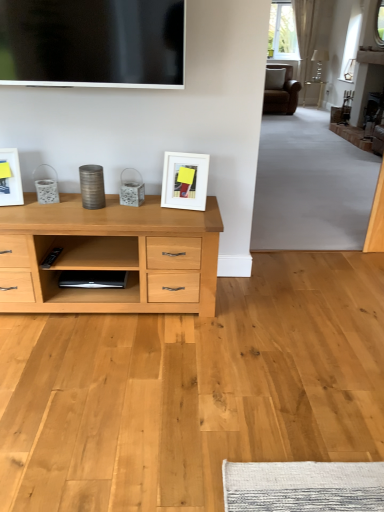
How much space does white glossy picture frame at left, positioned as the second picture frame in right-to-left order, occupy vertically?

It is 10.57 inches.

Describe the element at coordinates (10, 178) in the screenshot. The image size is (384, 512). I see `white glossy picture frame at left, positioned as the second picture frame in right-to-left order` at that location.

At what (x,y) coordinates should I click in order to perform the action: click on white matte picture frame at center, acting as the 2th picture frame starting from the left. Please return your answer as a coordinate pair (x, y). Image resolution: width=384 pixels, height=512 pixels. Looking at the image, I should click on (185, 181).

Does point (184, 161) come closer to viewer compared to point (2, 195)?

No, (184, 161) is behind (2, 195).

From the picture: Is white matte picture frame at center, acting as the 2th picture frame starting from the left, positioned behind white glossy picture frame at left, positioned as the second picture frame in right-to-left order?

Yes, white matte picture frame at center, acting as the 2th picture frame starting from the left, is further from the camera.

The height and width of the screenshot is (512, 384). Find the location of `picture frame beneath the white glossy picture frame at left, placed as the first picture frame when sorted from left to right (from a real-world perspective)`. picture frame beneath the white glossy picture frame at left, placed as the first picture frame when sorted from left to right (from a real-world perspective) is located at coordinates (185, 181).

How different are the orientations of white matte picture frame at center, the first picture frame in the right-to-left sequence, and white glossy picture frame at left, placed as the first picture frame when sorted from left to right, in degrees?

26.2 degrees.

Between point (2, 175) and point (184, 177), which one is positioned in front?

Positioned in front is point (2, 175).

Does white glossy picture frame at left, positioned as the second picture frame in right-to-left order, turn towards white matte picture frame at center, acting as the 2th picture frame starting from the left?

No.

Which object is positioned more to the right, white glossy picture frame at left, placed as the first picture frame when sorted from left to right, or white matte picture frame at center, acting as the 2th picture frame starting from the left?

From the viewer's perspective, white matte picture frame at center, acting as the 2th picture frame starting from the left, appears more on the right side.

From the image's perspective, which one is positioned lower, white glossy picture frame at left, placed as the first picture frame when sorted from left to right, or flat screen tv at upper center?

white glossy picture frame at left, placed as the first picture frame when sorted from left to right, is shown below in the image.

Can you confirm if white glossy picture frame at left, placed as the first picture frame when sorted from left to right, is positioned to the right of flat screen tv at upper center?

Incorrect, white glossy picture frame at left, placed as the first picture frame when sorted from left to right, is not on the right side of flat screen tv at upper center.

Who is more distant, white glossy picture frame at left, placed as the first picture frame when sorted from left to right, or flat screen tv at upper center?

white glossy picture frame at left, placed as the first picture frame when sorted from left to right.

Does white glossy picture frame at left, positioned as the second picture frame in right-to-left order, have a smaller size compared to flat screen tv at upper center?

Yes.

Considering the relative sizes of flat screen tv at upper center and white glossy picture frame at left, positioned as the second picture frame in right-to-left order, in the image provided, is flat screen tv at upper center wider than white glossy picture frame at left, positioned as the second picture frame in right-to-left order,?

No.

Could you tell me if flat screen tv at upper center is facing white glossy picture frame at left, placed as the first picture frame when sorted from left to right?

No, flat screen tv at upper center is not turned towards white glossy picture frame at left, placed as the first picture frame when sorted from left to right.

Is point (47, 51) closer to viewer compared to point (3, 156)?

Yes.

Based on their positions, is white matte picture frame at center, the first picture frame in the right-to-left sequence, located to the left or right of flat screen tv at upper center?

white matte picture frame at center, the first picture frame in the right-to-left sequence, is positioned on flat screen tv at upper center's right side.

From a real-world perspective, relative to flat screen tv at upper center, is white matte picture frame at center, acting as the 2th picture frame starting from the left, vertically above or below?

In terms of real-world spatial position, white matte picture frame at center, acting as the 2th picture frame starting from the left, is below flat screen tv at upper center.

Can you tell me how much white matte picture frame at center, acting as the 2th picture frame starting from the left, and flat screen tv at upper center differ in facing direction?

They differ by 9.36 degrees in their facing directions.

Looking at the image, does white matte picture frame at center, acting as the 2th picture frame starting from the left, seem bigger or smaller compared to flat screen tv at upper center?

Considering their sizes, white matte picture frame at center, acting as the 2th picture frame starting from the left, takes up less space than flat screen tv at upper center.

Considering the relative sizes of flat screen tv at upper center and white matte picture frame at center, acting as the 2th picture frame starting from the left, in the image provided, is flat screen tv at upper center thinner than white matte picture frame at center, acting as the 2th picture frame starting from the left,?

Yes.

The height and width of the screenshot is (512, 384). Identify the location of the 2nd picture frame positioned below the flat screen tv at upper center (from a real-world perspective). (185, 181).

Which point is more forward, (x=165, y=73) or (x=170, y=207)?

Point (x=165, y=73)

From a real-world perspective, is flat screen tv at upper center physically below white matte picture frame at center, the first picture frame in the right-to-left sequence?

Actually, flat screen tv at upper center is physically above white matte picture frame at center, the first picture frame in the right-to-left sequence, in the real world.

The height and width of the screenshot is (512, 384). I want to click on picture frame located on the left of white matte picture frame at center, the first picture frame in the right-to-left sequence, so (10, 178).

Locate an element on the screen. The width and height of the screenshot is (384, 512). picture frame above the white matte picture frame at center, the first picture frame in the right-to-left sequence (from the image's perspective) is located at coordinates click(x=10, y=178).

Estimate the real-world distances between objects in this image. Which object is closer to white glossy picture frame at left, positioned as the second picture frame in right-to-left order, flat screen tv at upper center or white matte picture frame at center, the first picture frame in the right-to-left sequence?

Based on the image, flat screen tv at upper center appears to be nearer to white glossy picture frame at left, positioned as the second picture frame in right-to-left order.

Estimate the real-world distances between objects in this image. Which object is closer to white matte picture frame at center, acting as the 2th picture frame starting from the left, white glossy picture frame at left, positioned as the second picture frame in right-to-left order, or flat screen tv at upper center?

Based on the image, flat screen tv at upper center appears to be nearer to white matte picture frame at center, acting as the 2th picture frame starting from the left.

Based on their spatial positions, is white matte picture frame at center, acting as the 2th picture frame starting from the left, or flat screen tv at upper center further from white glossy picture frame at left, positioned as the second picture frame in right-to-left order?

white matte picture frame at center, acting as the 2th picture frame starting from the left, is positioned further to the anchor white glossy picture frame at left, positioned as the second picture frame in right-to-left order.

Considering their positions, is white glossy picture frame at left, positioned as the second picture frame in right-to-left order, positioned closer to flat screen tv at upper center than white matte picture frame at center, acting as the 2th picture frame starting from the left?

white matte picture frame at center, acting as the 2th picture frame starting from the left, lies closer to flat screen tv at upper center than the other object.

Looking at the image, which one is located closer to flat screen tv at upper center, white matte picture frame at center, the first picture frame in the right-to-left sequence, or white glossy picture frame at left, placed as the first picture frame when sorted from left to right?

white matte picture frame at center, the first picture frame in the right-to-left sequence.

When comparing their distances from white matte picture frame at center, acting as the 2th picture frame starting from the left, does flat screen tv at upper center or white glossy picture frame at left, placed as the first picture frame when sorted from left to right, seem further?

Based on the image, white glossy picture frame at left, placed as the first picture frame when sorted from left to right, appears to be further to white matte picture frame at center, acting as the 2th picture frame starting from the left.

Locate an element on the screen. This screenshot has width=384, height=512. television situated between white glossy picture frame at left, placed as the first picture frame when sorted from left to right, and white matte picture frame at center, the first picture frame in the right-to-left sequence, from left to right is located at coordinates (93, 42).